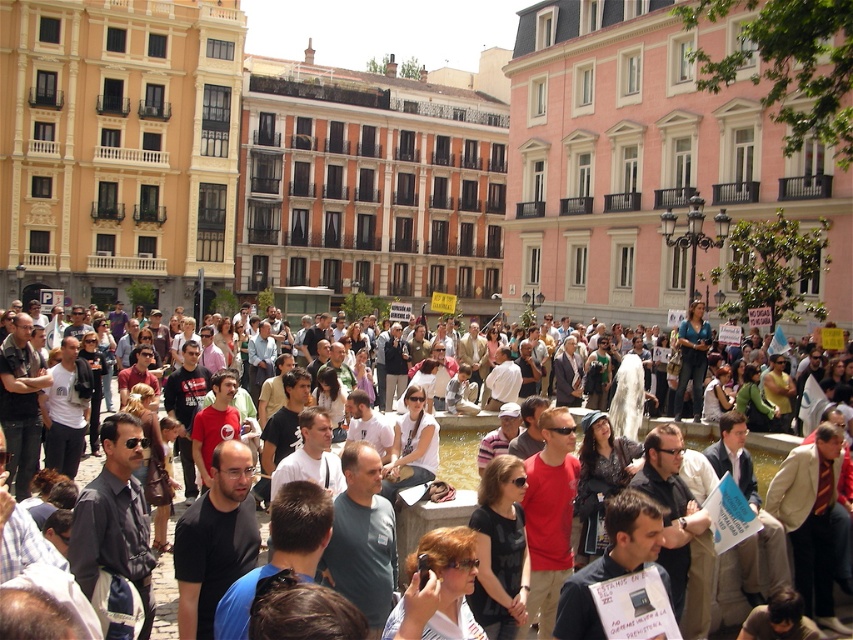
Question: Is matte black phone at center to the right of leather jacket at center from the viewer's perspective?

Choices:
 (A) yes
 (B) no

Answer: (B)

Question: Does matte black phone at center have a smaller size compared to leather jacket at center?

Choices:
 (A) no
 (B) yes

Answer: (A)

Question: Which point is closer to the camera?

Choices:
 (A) (587, 470)
 (B) (402, 433)
 (C) (395, 611)
 (D) (502, 548)

Answer: (C)

Question: Which point is closer to the camera taking this photo?

Choices:
 (A) (416, 468)
 (B) (432, 627)
 (C) (512, 531)
 (D) (582, 449)

Answer: (B)

Question: Does black fabric shirt at center appear on the left side of leather jacket at center?

Choices:
 (A) yes
 (B) no

Answer: (A)

Question: Which point is farther from the camera taking this photo?

Choices:
 (A) (486, 518)
 (B) (412, 417)
 (C) (440, 552)

Answer: (B)